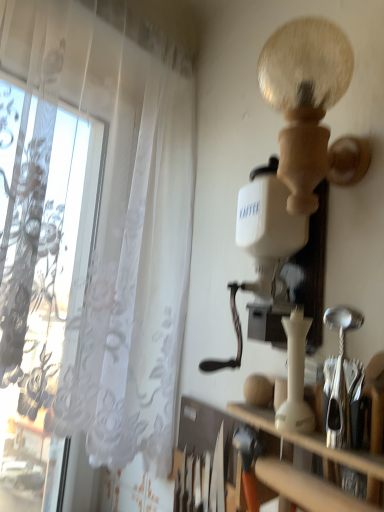
Where is `white sheer curtain at left`? This screenshot has height=512, width=384. white sheer curtain at left is located at coordinates (92, 232).

What do you see at coordinates (92, 232) in the screenshot?
I see `white sheer curtain at left` at bounding box center [92, 232].

Measure the distance between point (41, 300) and camera.

Point (41, 300) is 36.61 inches from camera.

Where is `wooden at right`? wooden at right is located at coordinates (307, 489).

What do you see at coordinates (307, 489) in the screenshot?
I see `wooden at right` at bounding box center [307, 489].

Identify the location of white sheer curtain at left. (92, 232).

Would you say white sheer curtain at left is to the left or to the right of wooden at right in the picture?

white sheer curtain at left is positioned on wooden at right's left side.

Does white sheer curtain at left come behind wooden at right?

Yes, it is behind wooden at right.

Which point is more forward, (75, 30) or (303, 502)?

The point (303, 502) is closer.

From the image's perspective, is white sheer curtain at left beneath wooden at right?

No, from the image's perspective, white sheer curtain at left is not beneath wooden at right.

From a real-world perspective, is white sheer curtain at left physically above wooden at right?

Correct, in the physical world, white sheer curtain at left is higher than wooden at right.

Considering the sizes of objects white sheer curtain at left and wooden at right in the image provided, who is wider, white sheer curtain at left or wooden at right?

white sheer curtain at left is wider.

Considering the relative sizes of white sheer curtain at left and wooden at right in the image provided, is white sheer curtain at left taller than wooden at right?

Indeed, white sheer curtain at left has a greater height compared to wooden at right.

Who is bigger, white sheer curtain at left or wooden at right?

white sheer curtain at left is bigger.

Is white sheer curtain at left situated inside wooden at right or outside?

white sheer curtain at left lies outside wooden at right.

In the scene shown: Is white sheer curtain at left beside wooden at right?

white sheer curtain at left is not next to wooden at right, and they're not touching.

Is white sheer curtain at left aimed at wooden at right?

Yes.

Based on the photo, measure the distance from white sheer curtain at left to wooden at right.

A distance of 23.84 inches exists between white sheer curtain at left and wooden at right.

This screenshot has width=384, height=512. In the image, there is a wooden at right. Find the location of `curtain above it (from the image's perspective)`. curtain above it (from the image's perspective) is located at coordinates (92, 232).

Considering the relative positions of wooden at right and white sheer curtain at left in the image provided, is wooden at right to the right of white sheer curtain at left from the viewer's perspective?

Correct, you'll find wooden at right to the right of white sheer curtain at left.

Which object is closer to the camera taking this photo, wooden at right or white sheer curtain at left?

wooden at right is in front.

Which is more distant, (286, 463) or (76, 42)?

The point (76, 42) is farther from the camera.

From the image's perspective, is wooden at right under white sheer curtain at left?

Correct, wooden at right appears lower than white sheer curtain at left in the image.

From a real-world perspective, is wooden at right above or below white sheer curtain at left?

wooden at right is below white sheer curtain at left.

Between wooden at right and white sheer curtain at left, which one has larger width?

white sheer curtain at left.

Who is taller, wooden at right or white sheer curtain at left?

white sheer curtain at left is taller.

Which of these two, wooden at right or white sheer curtain at left, is smaller?

wooden at right.

Would you say wooden at right is outside white sheer curtain at left?

wooden at right lies outside white sheer curtain at left's area.

Does wooden at right touch white sheer curtain at left?

wooden at right and white sheer curtain at left are clearly separated.

Is wooden at right aimed at white sheer curtain at left?

No, wooden at right does not turn towards white sheer curtain at left.

How many degrees apart are the facing directions of wooden at right and white sheer curtain at left?

They differ by 115 degrees in their facing directions.

Measure the distance from wooden at right to white sheer curtain at left.

The distance of wooden at right from white sheer curtain at left is 23.84 inches.

Locate an element on the screen. Image resolution: width=384 pixels, height=512 pixels. curtain on the left of wooden at right is located at coordinates (92, 232).

Where is `shelf on the right of white sheer curtain at left`? shelf on the right of white sheer curtain at left is located at coordinates (307, 489).

Find the location of a particular element. The height and width of the screenshot is (512, 384). curtain behind the wooden at right is located at coordinates (92, 232).